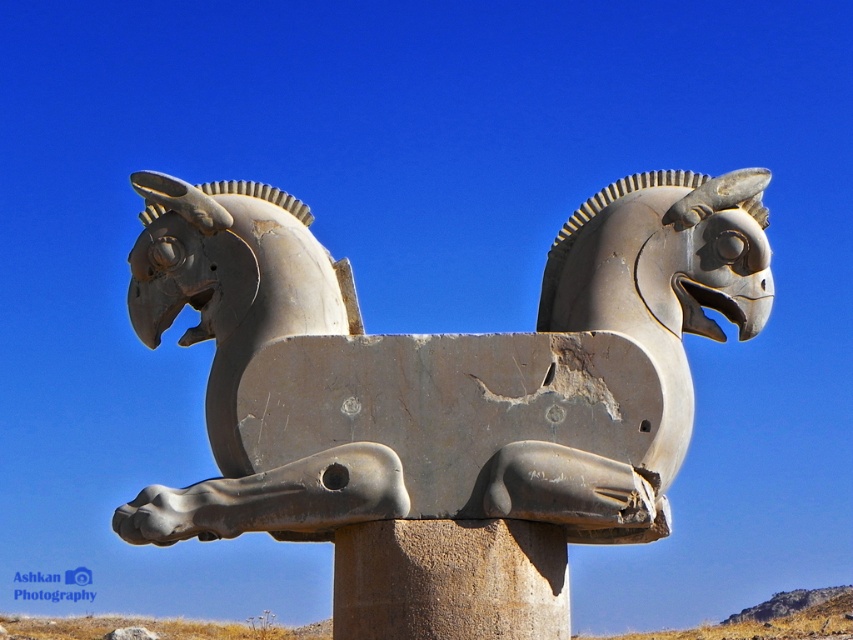
Between gray stone sculpture at center and rusty stone pillar at center, which one is positioned higher?

Positioned higher is gray stone sculpture at center.

Describe the element at coordinates (444, 396) in the screenshot. I see `gray stone sculpture at center` at that location.

The image size is (853, 640). In order to click on gray stone sculpture at center in this screenshot , I will do `click(444, 396)`.